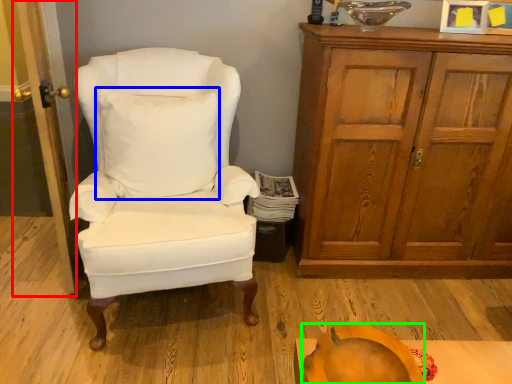
Question: Which object is positioned farthest from door (highlighted by a red box)? Select from pillow (highlighted by a blue box) and pumpkin (highlighted by a green box).

Choices:
 (A) pillow
 (B) pumpkin

Answer: (B)